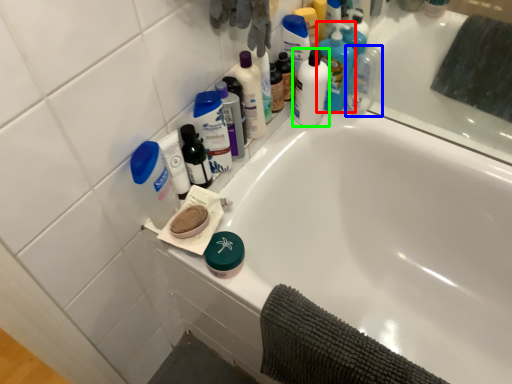
Question: Which object is positioned closest to cleaning product (highlighted by a red box)? Select from mouthwash (highlighted by a blue box) and mouthwash (highlighted by a green box).

Choices:
 (A) mouthwash
 (B) mouthwash

Answer: (A)